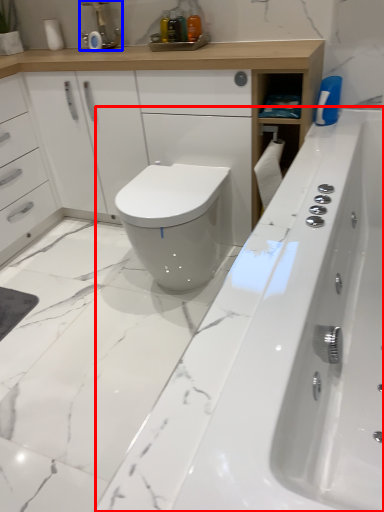
Question: Which point is closer to the camera, bath (highlighted by a red box) or faucet (highlighted by a blue box)?

Choices:
 (A) bath
 (B) faucet

Answer: (A)